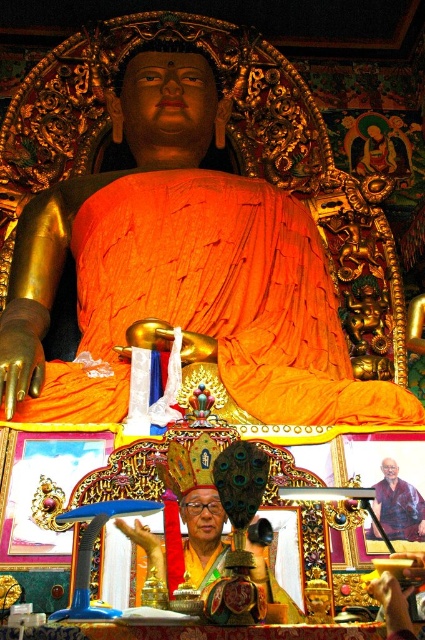
Question: Is golden polished statue at center in front of purple fabric at center?

Choices:
 (A) no
 (B) yes

Answer: (A)

Question: Which object is the farthest from the golden polished statue at center?

Choices:
 (A) matte gold statue at center
 (B) purple fabric at center

Answer: (A)

Question: Which of the following is the closest to the observer?

Choices:
 (A) (379, 497)
 (B) (402, 612)

Answer: (B)

Question: Is golden polished statue at center thinner than purple fabric at center?

Choices:
 (A) yes
 (B) no

Answer: (B)

Question: Does purple fabric at center appear over matte gold statue at center?

Choices:
 (A) yes
 (B) no

Answer: (A)

Question: Considering the real-world distances, which object is farthest from the matte gold statue at center?

Choices:
 (A) golden polished statue at center
 (B) purple fabric at center

Answer: (A)